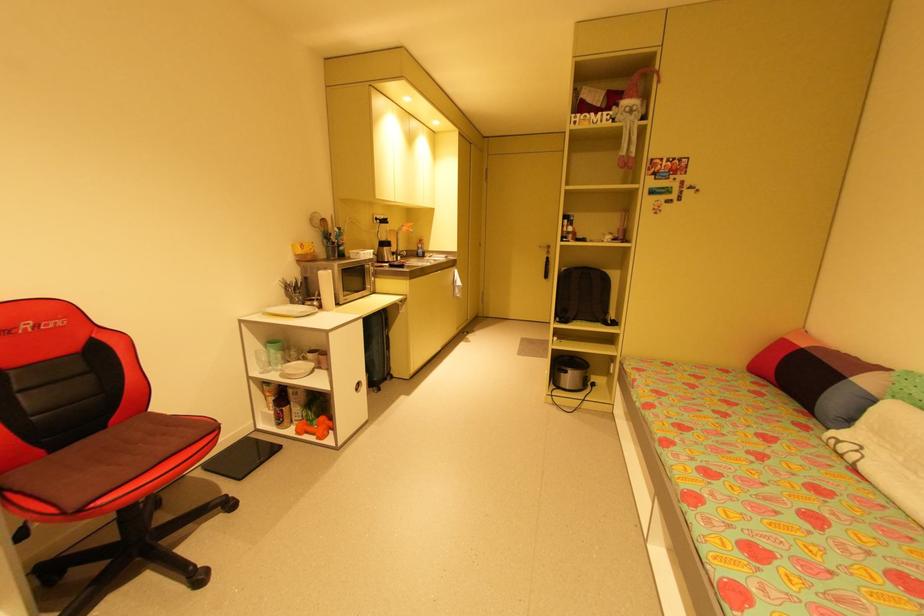
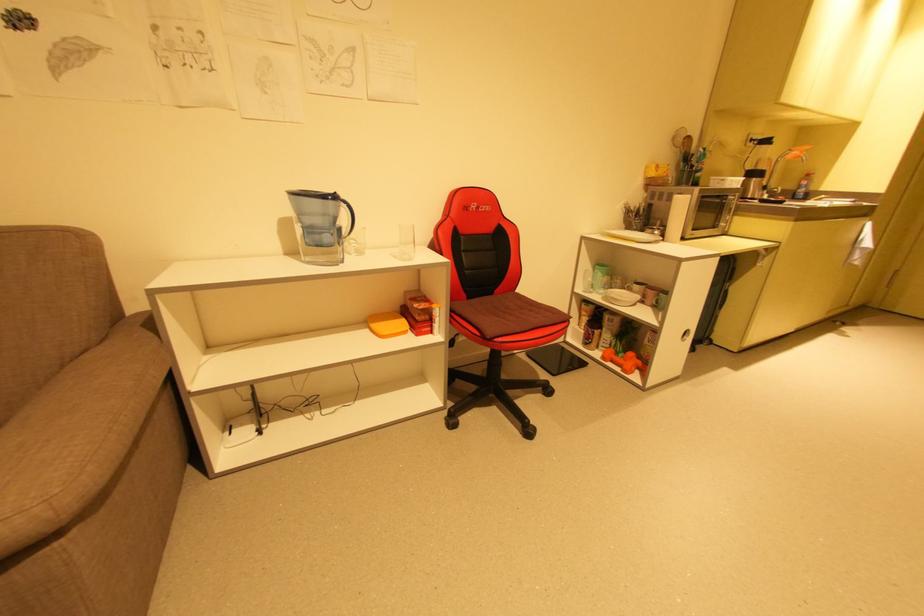
Locate, in the second image, the point that corresponds to the point at 293,363 in the first image.

(616, 290)